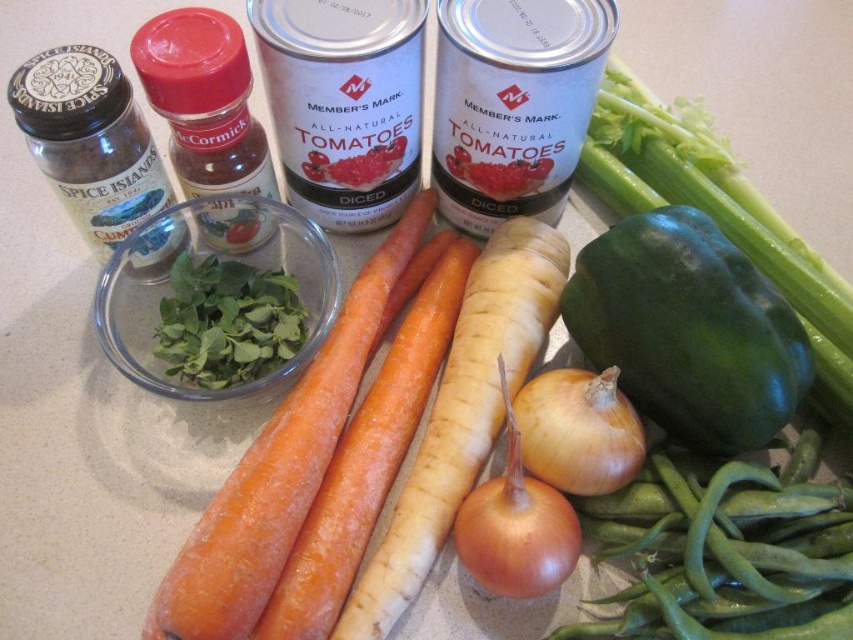
Question: Among these points, which one is nearest to the camera?

Choices:
 (A) (728, 589)
 (B) (297, 396)
 (C) (602, 116)
 (D) (524, 460)

Answer: (A)

Question: Is green smooth skin beans at lower right positioned before green matte bell pepper at center-right?

Choices:
 (A) yes
 (B) no

Answer: (A)

Question: Is orange smooth carrot at center further to the viewer compared to yellow matte onion at center?

Choices:
 (A) yes
 (B) no

Answer: (B)

Question: Among these points, which one is nearest to the camera?

Choices:
 (A) (761, 227)
 (B) (567, 493)
 (C) (195, 609)

Answer: (C)

Question: Does orange smooth carrot at center appear on the right side of yellow matte onion at center?

Choices:
 (A) no
 (B) yes

Answer: (A)

Question: Which point appears closest to the camera in this image?

Choices:
 (A) (271, 560)
 (B) (503, 586)
 (C) (612, 490)
 (D) (666, 118)

Answer: (A)